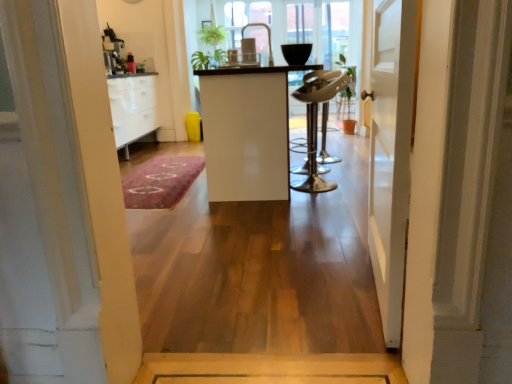
At what (x,y) coordinates should I click in order to perform the action: click on free area in between white glossy cabinet at center and white wooden door at center. Please return your answer as a coordinate pair (x, y). Looking at the image, I should click on (292, 221).